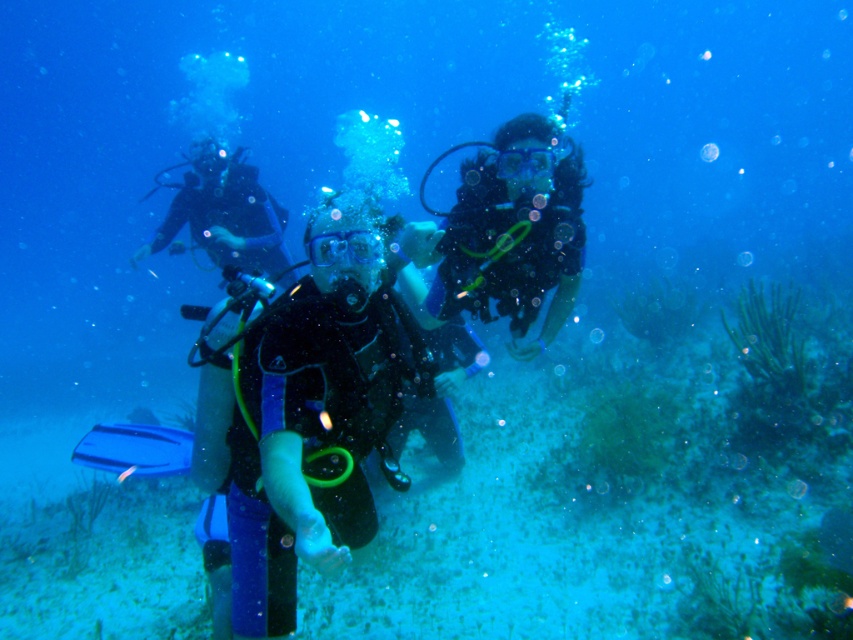
Question: Can you confirm if black matte scuba diver at center is wider than matte black scuba diver at center?

Choices:
 (A) no
 (B) yes

Answer: (B)

Question: Which object is positioned closest to the matte black scuba diver at center?

Choices:
 (A) black matte scuba diver at center
 (B) black matte scuba diver at left

Answer: (A)

Question: Which object is positioned farthest from the matte black scuba diver at center?

Choices:
 (A) black matte scuba diver at center
 (B) black matte scuba diver at left

Answer: (B)

Question: Which point is farther from the camera taking this photo?

Choices:
 (A) (218, 208)
 (B) (566, 164)

Answer: (A)

Question: Is black matte scuba diver at center thinner than matte black scuba diver at center?

Choices:
 (A) no
 (B) yes

Answer: (A)

Question: Is black matte scuba diver at center to the right of black matte scuba diver at left from the viewer's perspective?

Choices:
 (A) yes
 (B) no

Answer: (A)